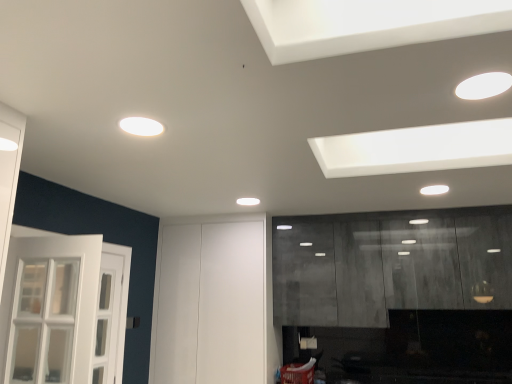
Question: Is white glossy light fixture at upper right, acting as the 2th lighting starting from the left, to the left or to the right of matte gray cabinetry at right in the image?

Choices:
 (A) right
 (B) left

Answer: (B)

Question: Considering the positions of point (480, 79) and point (303, 291), is point (480, 79) closer or farther from the camera than point (303, 291)?

Choices:
 (A) farther
 (B) closer

Answer: (B)

Question: Which object is the closest to the matte gray cabinetry at right?

Choices:
 (A) white glossy light fixture at upper right, acting as the 2th lighting starting from the left
 (B) white matte door at center
 (C) white matte light fixture at upper center, the second lighting when ordered from right to left

Answer: (B)

Question: Which object is positioned closest to the white glossy light fixture at upper right, the second lighting viewed from the back?

Choices:
 (A) white matte light fixture at upper center, the 2th lighting in the top-to-bottom sequence
 (B) matte gray cabinetry at right
 (C) white matte door at center

Answer: (A)